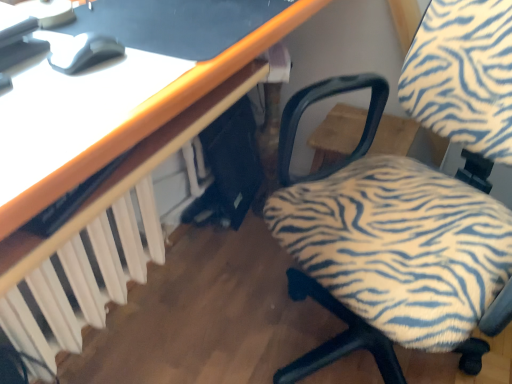
Question: From their relative heights in the image, would you say zebra-patterned fabric chair at center-right is taller or shorter than white plastic radiator at lower left?

Choices:
 (A) tall
 (B) short

Answer: (A)

Question: Considering their positions, is zebra-patterned fabric chair at center-right located in front of or behind white plastic radiator at lower left?

Choices:
 (A) behind
 (B) front

Answer: (B)

Question: Which is farther from the white plastic radiator at lower left?

Choices:
 (A) matte gray mouse at upper left
 (B) zebra-patterned fabric chair at center-right

Answer: (B)

Question: Considering the real-world distances, which object is farthest from the zebra-patterned fabric chair at center-right?

Choices:
 (A) white plastic radiator at lower left
 (B) matte gray mouse at upper left

Answer: (A)